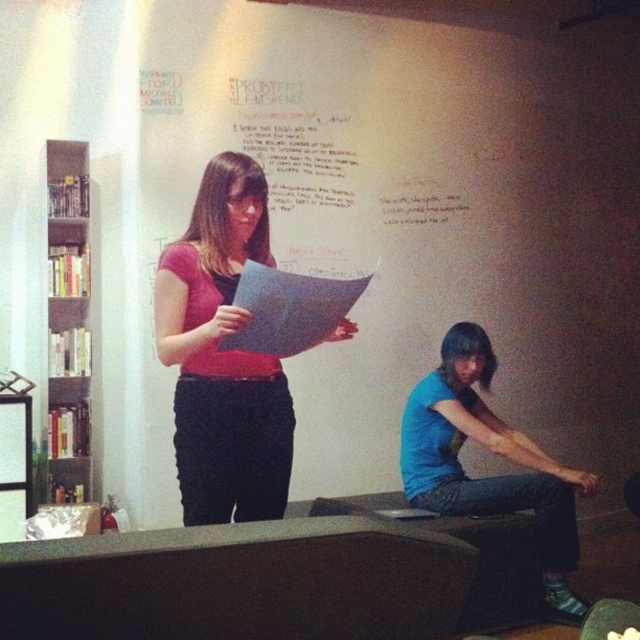
Between matte pink shirt at center and gray mesh bookshelf at left, which one is positioned lower?

matte pink shirt at center

Is matte pink shirt at center bigger than gray mesh bookshelf at left?

Indeed, matte pink shirt at center has a larger size compared to gray mesh bookshelf at left.

This screenshot has height=640, width=640. I want to click on matte pink shirt at center, so click(221, 355).

At what (x,y) coordinates should I click in order to perform the action: click on white paper at upper center. Please return your answer as a coordinate pair (x, y). This screenshot has height=640, width=640. Looking at the image, I should click on (422, 205).

This screenshot has width=640, height=640. What do you see at coordinates (422, 205) in the screenshot?
I see `white paper at upper center` at bounding box center [422, 205].

Find the location of a particular element. white paper at upper center is located at coordinates (422, 205).

Can you confirm if white paper at upper center is bigger than gray mesh bookshelf at left?

Indeed, white paper at upper center has a larger size compared to gray mesh bookshelf at left.

The image size is (640, 640). Identify the location of white paper at upper center. (422, 205).

I want to click on white paper at upper center, so click(422, 205).